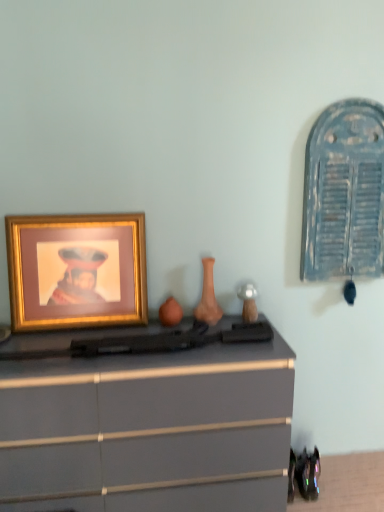
Question: Which is correct: matte orange vase at center is inside gold metallic picture frame at left, or outside of it?

Choices:
 (A) outside
 (B) inside

Answer: (A)

Question: Considering the positions of point (208, 262) and point (92, 245), is point (208, 262) closer or farther from the camera than point (92, 245)?

Choices:
 (A) closer
 (B) farther

Answer: (B)

Question: Which object is positioned farthest from the matte gray chest of drawers at center?

Choices:
 (A) matte orange vase at center
 (B) gold metallic picture frame at left

Answer: (A)

Question: Which object is the closest to the matte gray chest of drawers at center?

Choices:
 (A) gold metallic picture frame at left
 (B) matte orange vase at center

Answer: (A)